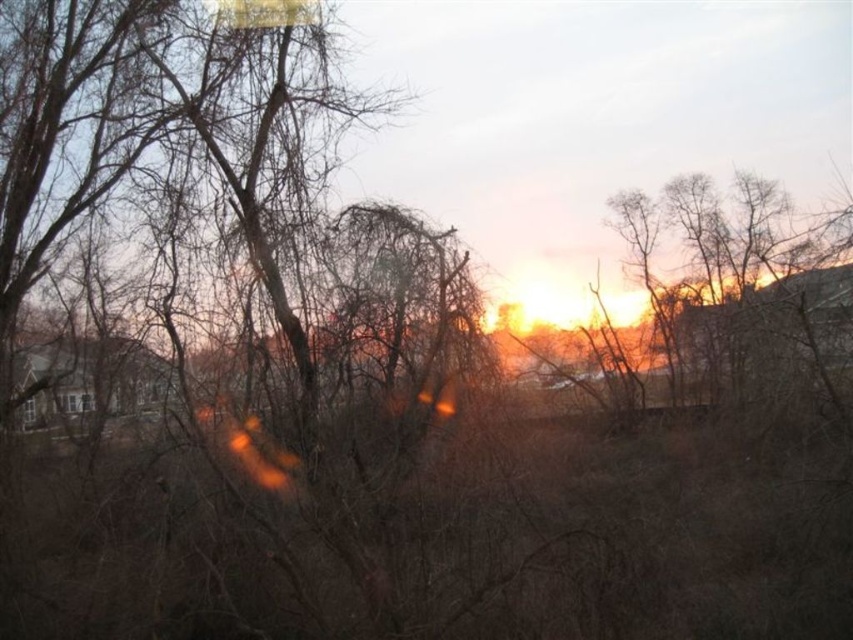
The image size is (853, 640). Describe the element at coordinates (77, 403) in the screenshot. I see `clear glass window at lower left` at that location.

From the picture: Can you confirm if clear glass window at lower left is smaller than transparent glass window at lower left?

No, clear glass window at lower left is not smaller than transparent glass window at lower left.

Does point (91, 408) lie in front of point (22, 412)?

Yes, point (91, 408) is in front of point (22, 412).

This screenshot has height=640, width=853. Identify the location of clear glass window at lower left. (77, 403).